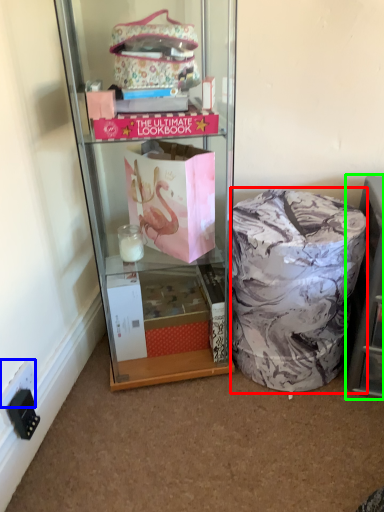
Question: Considering the real-world distances, which object is closest to material (highlighted by a red box)? power outlet (highlighted by a blue box) or shelf (highlighted by a green box).

Choices:
 (A) power outlet
 (B) shelf

Answer: (B)